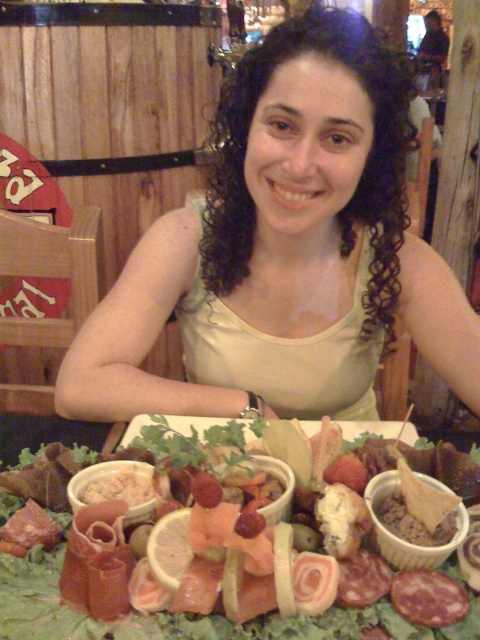
You are a photographer setting up a shot of the charcuterie board and the person. You want to ensure the green fabric tank top at center is to the left of the matte white cheese at center. Is the current arrangement correct?

The green fabric tank top at center is positioned on the right side of matte white cheese at center, so the current arrangement is incorrect because the tank top is on the right instead of the left as desired.

You are a fashion designer analyzing the image. You need to determine the exact location of the green fabric tank top at center in the image. What are its coordinates?

The green fabric tank top at center is located at coordinates point (x=282, y=236).